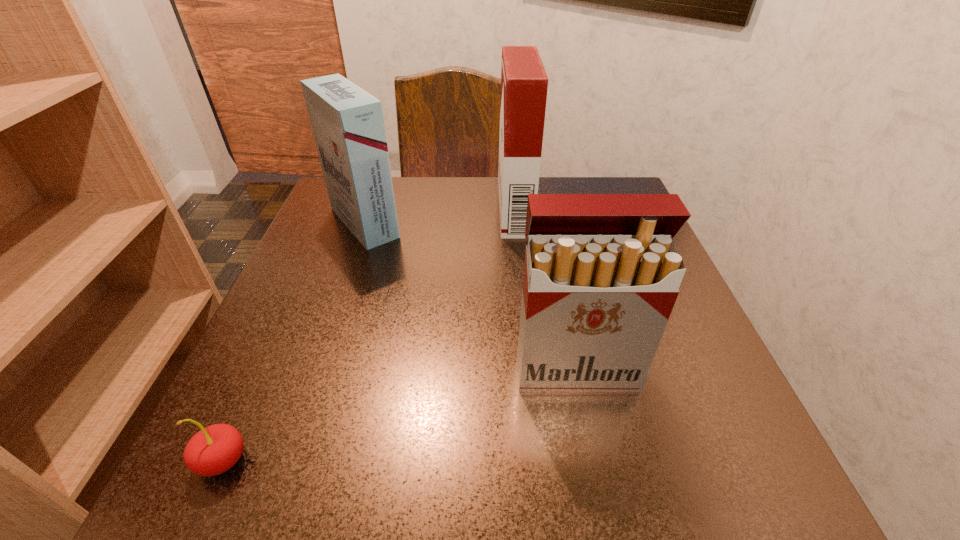
Where is `the leftmost cigarette case`? This screenshot has height=540, width=960. the leftmost cigarette case is located at coordinates (347, 122).

Locate an element on the screen. the nearest cigarette case is located at coordinates (602, 272).

I want to click on the nearest object, so click(x=215, y=449).

Identify the location of cherry. (215, 449).

In order to click on vacant space located on the right of the leftmost cigarette case in this screenshot , I will do `click(492, 222)`.

Locate an element on the screen. The image size is (960, 540). vacant space situated 0.100m with the lid open on the third farthest object is located at coordinates (592, 457).

This screenshot has height=540, width=960. Find the location of `vacant space situated 0.090m on the right of the shortest object`. vacant space situated 0.090m on the right of the shortest object is located at coordinates (317, 461).

You are a GUI agent. You are given a task and a screenshot of the screen. Output one action in this format:
    pyautogui.click(x=<x>, y=<y>)
    Task: Click on the object located in the near edge section of the desktop
    
    Given the screenshot: What is the action you would take?
    pyautogui.click(x=215, y=449)

The height and width of the screenshot is (540, 960). I want to click on cigarette case at the left edge, so click(347, 122).

This screenshot has width=960, height=540. I want to click on cherry that is at the left edge, so click(215, 449).